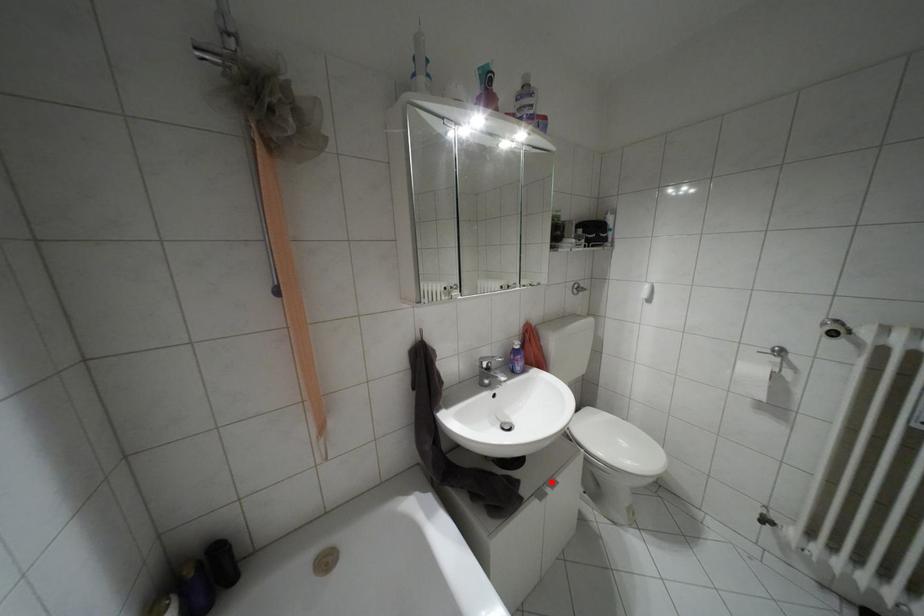
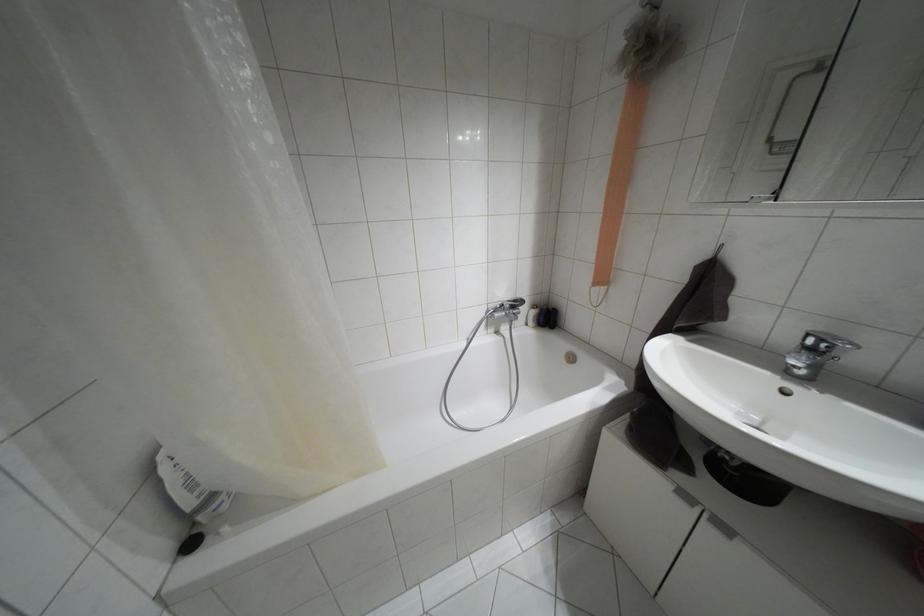
Question: I am providing you with two images of the same scene from different viewpoints. In image1, a red point is highlighted. Considering the same 3D point in image2, which of the following is correct?

Choices:
 (A) It is closer
 (B) It is farther

Answer: (A)